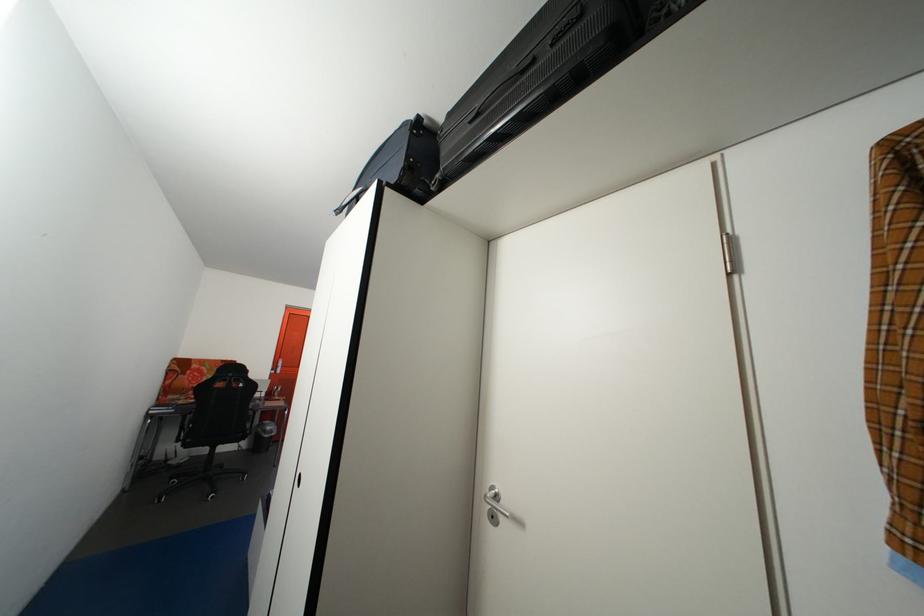
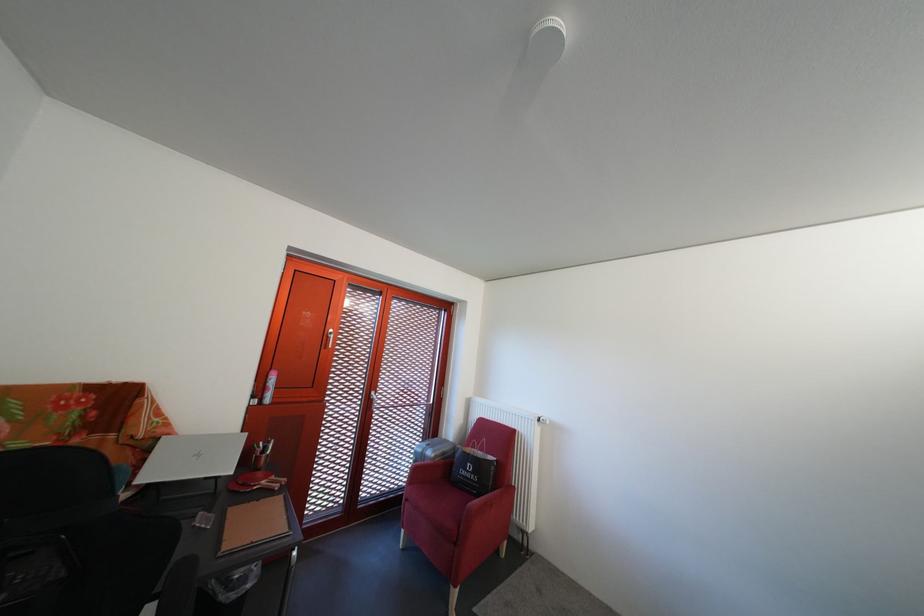
Which direction would the cameraman need to move to produce the second image?

The movement direction of the cameraman is left, forward.